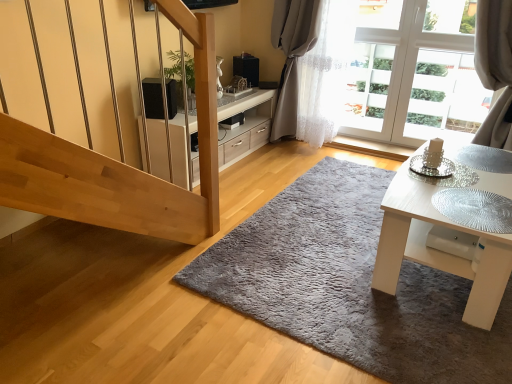
Question: Is gray fluffy rug at center taller or shorter than white glossy table at lower right?

Choices:
 (A) tall
 (B) short

Answer: (B)

Question: Based on their sizes in the image, would you say gray fluffy rug at center is bigger or smaller than white glossy table at lower right?

Choices:
 (A) big
 (B) small

Answer: (B)

Question: Which is nearer to the black matte speaker at upper center?

Choices:
 (A) gray fluffy rug at center
 (B) white glossy cabinet at center
 (C) white sheer curtain at upper right
 (D) white glossy table at lower right

Answer: (B)

Question: Which object is positioned closest to the white sheer curtain at upper right?

Choices:
 (A) white glossy table at lower right
 (B) white glossy cabinet at center
 (C) gray fluffy rug at center
 (D) black matte speaker at upper center

Answer: (B)